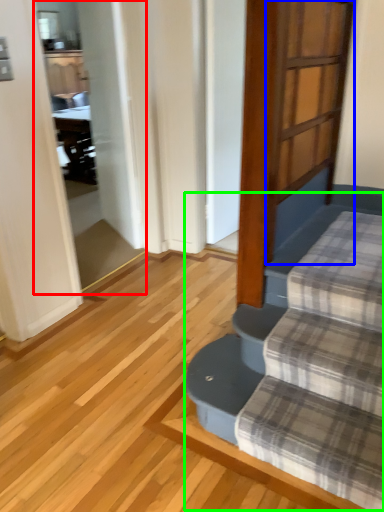
Question: Based on their relative distances, which object is farther from screen door (highlighted by a red box)? Choose from screen door (highlighted by a blue box) and stairwell (highlighted by a green box).

Choices:
 (A) screen door
 (B) stairwell

Answer: (B)